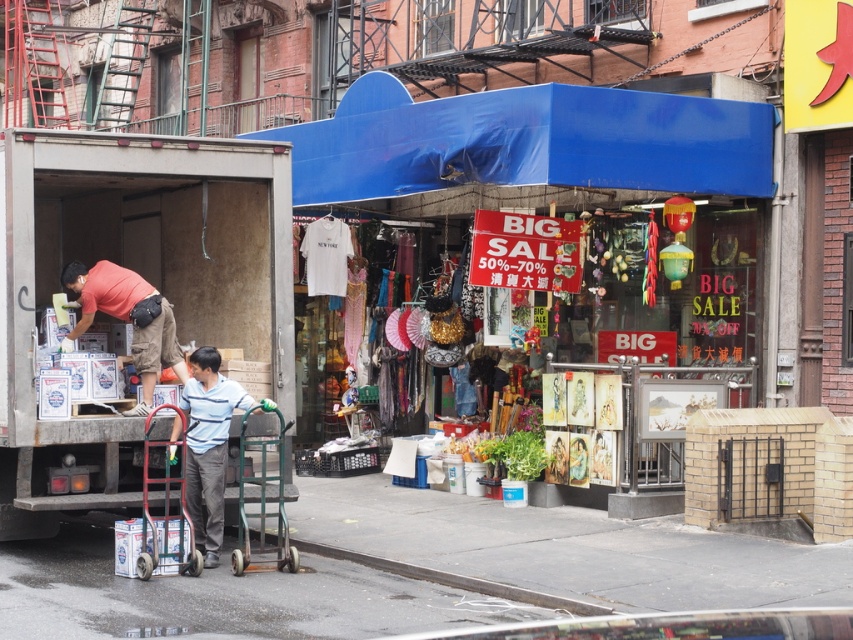
Question: Based on their relative distances, which object is farther from the metallic red hand truck at center?

Choices:
 (A) striped cotton shirt at center
 (B) green metallic handcart at center

Answer: (B)

Question: Estimate the real-world distances between objects in this image. Which object is farther from the striped cotton shirt at center?

Choices:
 (A) blue fabric awning at center
 (B) matte red shirt at left
 (C) green metallic handcart at center
 (D) blue fabric canopy at upper center

Answer: (D)

Question: Which of the following is the farthest from the observer?

Choices:
 (A) (128, 312)
 (B) (349, 132)
 (C) (705, 177)

Answer: (B)

Question: Does striped cotton shirt at center appear on the right side of green metallic handcart at center?

Choices:
 (A) no
 (B) yes

Answer: (A)

Question: Is blue fabric canopy at upper center bigger than striped cotton shirt at center?

Choices:
 (A) no
 (B) yes

Answer: (B)

Question: Is blue fabric canopy at upper center to the right of metallic red hand truck at center from the viewer's perspective?

Choices:
 (A) yes
 (B) no

Answer: (A)